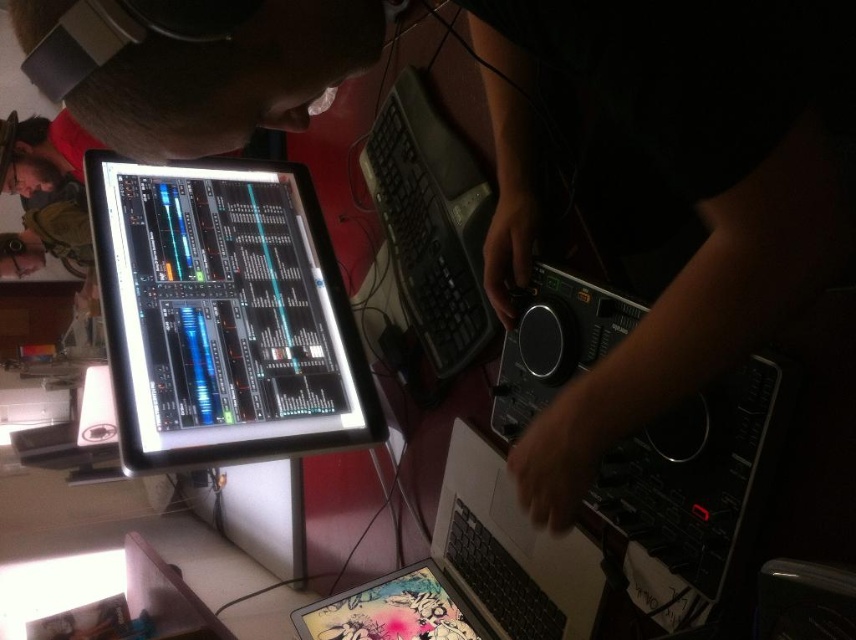
Can you confirm if matte black monitor at upper left is positioned to the right of metallic silver laptop at lower center?

No, matte black monitor at upper left is not to the right of metallic silver laptop at lower center.

Is matte black monitor at upper left taller than metallic silver laptop at lower center?

Indeed, matte black monitor at upper left has a greater height compared to metallic silver laptop at lower center.

Is point (159, 440) positioned after point (498, 536)?

No, it is not.

Identify the location of matte black monitor at upper left. This screenshot has width=856, height=640. (224, 314).

Who is taller, metallic silver laptop at lower center or matte plastic tablet at lower center?

Standing taller between the two is metallic silver laptop at lower center.

Which of these two, metallic silver laptop at lower center or matte plastic tablet at lower center, stands shorter?

Standing shorter between the two is matte plastic tablet at lower center.

Which is behind, point (402, 600) or point (343, 628)?

The point (402, 600) is behind.

The width and height of the screenshot is (856, 640). I want to click on metallic silver laptop at lower center, so click(473, 570).

Between metallic silver laptop at lower center and black plastic keyboard at center, which one is positioned lower?

Positioned lower is metallic silver laptop at lower center.

What do you see at coordinates (473, 570) in the screenshot? This screenshot has height=640, width=856. I see `metallic silver laptop at lower center` at bounding box center [473, 570].

Locate an element on the screen. The width and height of the screenshot is (856, 640). metallic silver laptop at lower center is located at coordinates (473, 570).